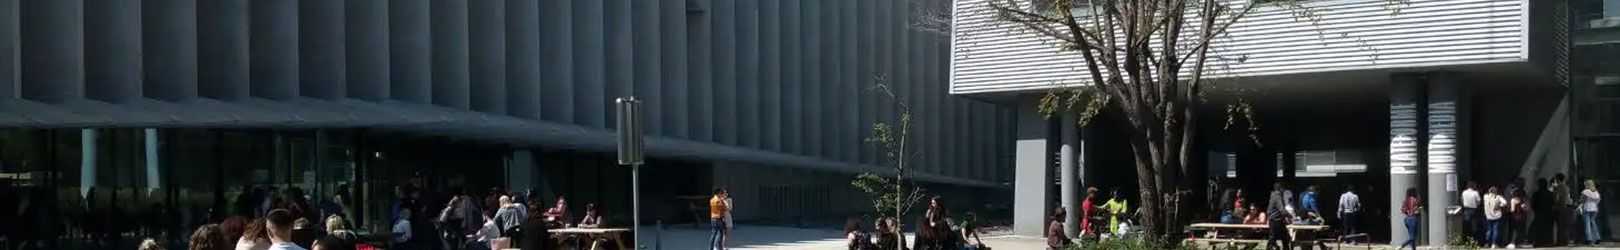
Identify the location of pillars. (1396, 134), (1445, 139), (1071, 164), (1029, 167).